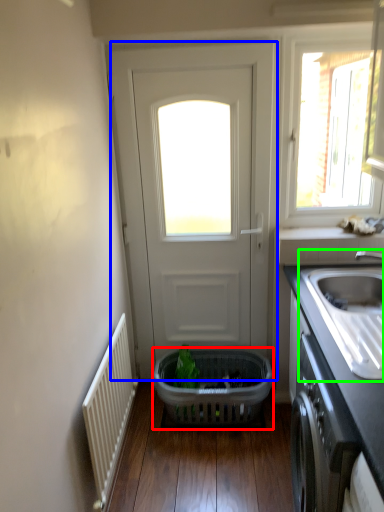
Question: Based on their relative distances, which object is farther from basket (highlighted by a red box)? Choose from door (highlighted by a blue box) and sink (highlighted by a green box).

Choices:
 (A) door
 (B) sink

Answer: (B)